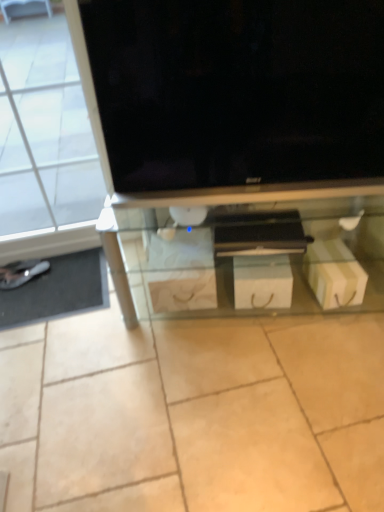
Where is `vacant space in black glossy tv at upper center (from a real-world perspective)`? vacant space in black glossy tv at upper center (from a real-world perspective) is located at coordinates (231, 182).